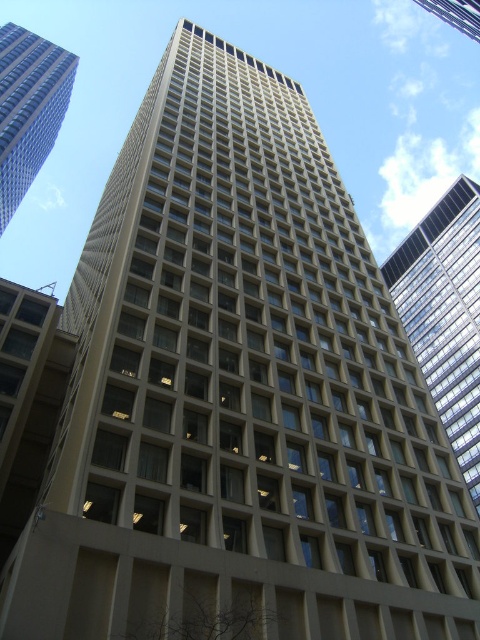
You are an architect reviewing a building blueprint and notice two beige glass elements in the design. The first is the beige glass windows at lower left, and the second is the beige glass building at upper center. Based on their sizes, which one would require more glass material for construction?

The beige glass building at upper center requires more glass material because it is larger than the beige glass windows at lower left.

You are standing at the base of the modern office building and looking up at its facade. There are two points marked on the building. One is labeled as point (397,292) and the other as point (437,6). From your vantage point, which point appears closer to you?

Point (437,6) appears closer because it is in front of point (397,292).

You are a drone operator who needs to fly a drone between the beige concrete building at upper left and the beige glass building at upper center. The drone has a maximum flight distance of 150 meters. Can the drone safely fly between these two buildings without exceeding its range limit?

The beige concrete building at upper left is 163.83 meters from the beige glass building at upper center. Since the drone has a maximum flight distance of 150 meters, it cannot safely fly between them without exceeding its range limit.